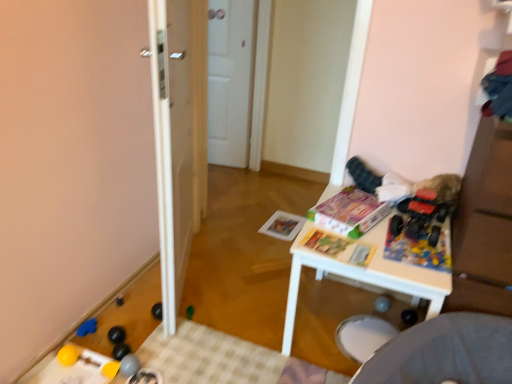
This screenshot has height=384, width=512. I want to click on blank space above matte paper magazine at center, positioned as the third magazine in front-to-back order (from a real-world perspective), so click(x=283, y=223).